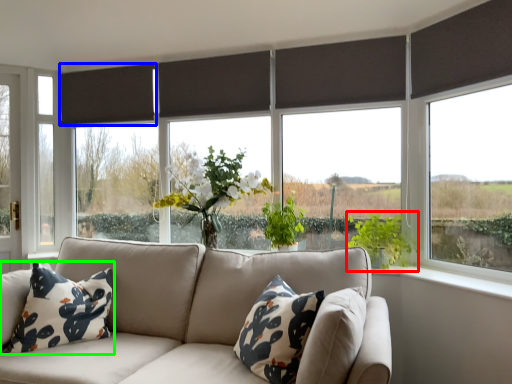
Question: Which object is positioned closest to vegetation (highlighted by a red box)? Select from curtain (highlighted by a blue box) and pillow (highlighted by a green box).

Choices:
 (A) curtain
 (B) pillow

Answer: (B)